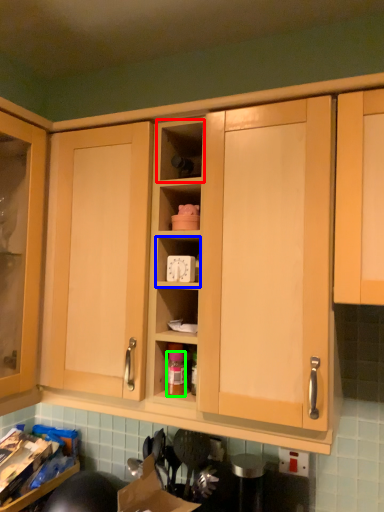
Question: Considering the real-world distances, which object is closest to shelf (highlighted by a red box)? cabinet (highlighted by a blue box) or bottle (highlighted by a green box).

Choices:
 (A) cabinet
 (B) bottle

Answer: (A)